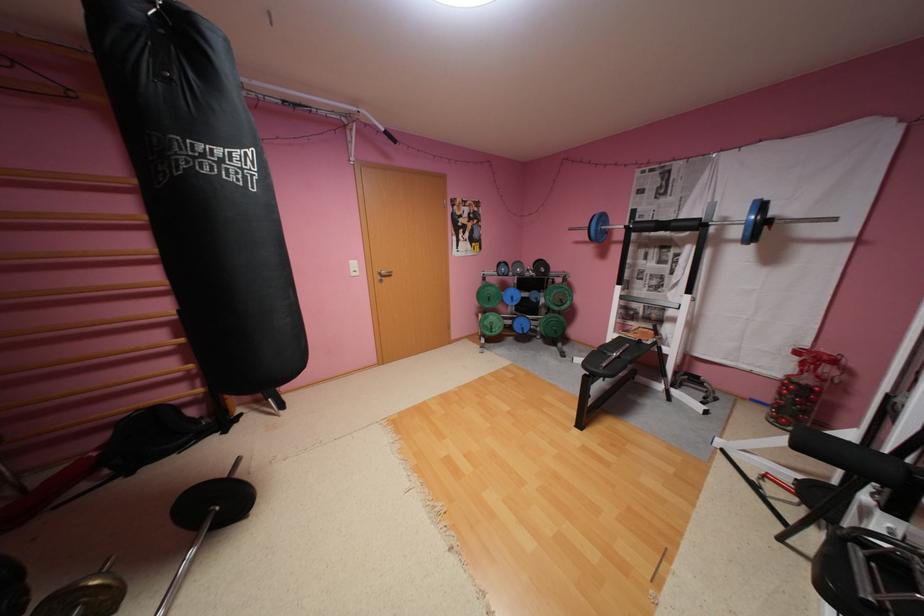
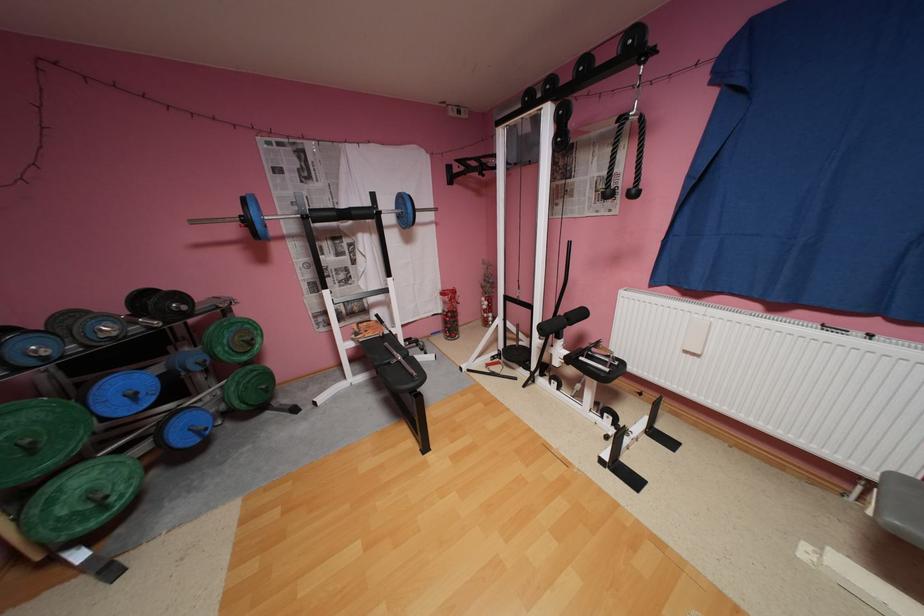
In the second image, find the point that corresponds to the point at 501,331 in the first image.

(116, 508)